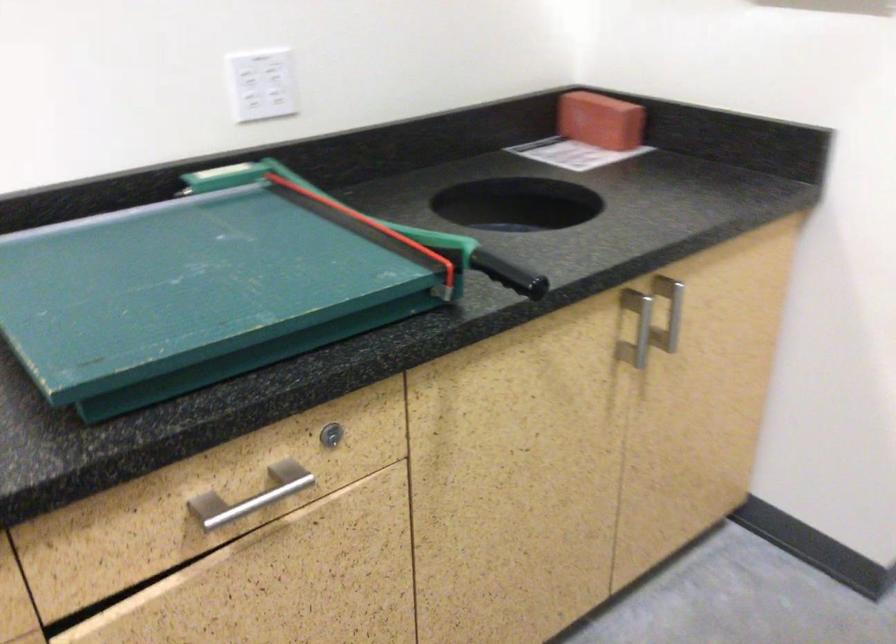
What do you see at coordinates (331, 435) in the screenshot?
I see `the drawer keyhole` at bounding box center [331, 435].